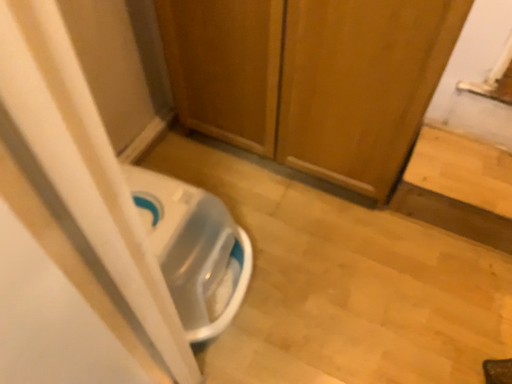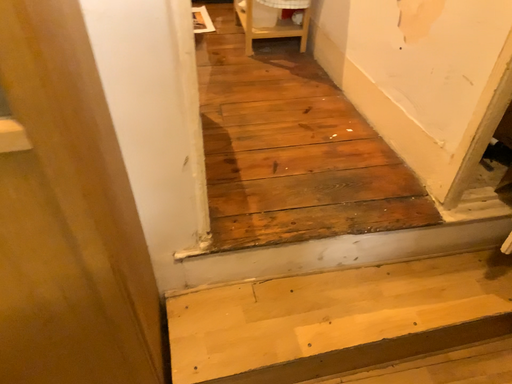
Question: How did the camera likely rotate when shooting the video?

Choices:
 (A) rotated upward
 (B) rotated downward

Answer: (A)